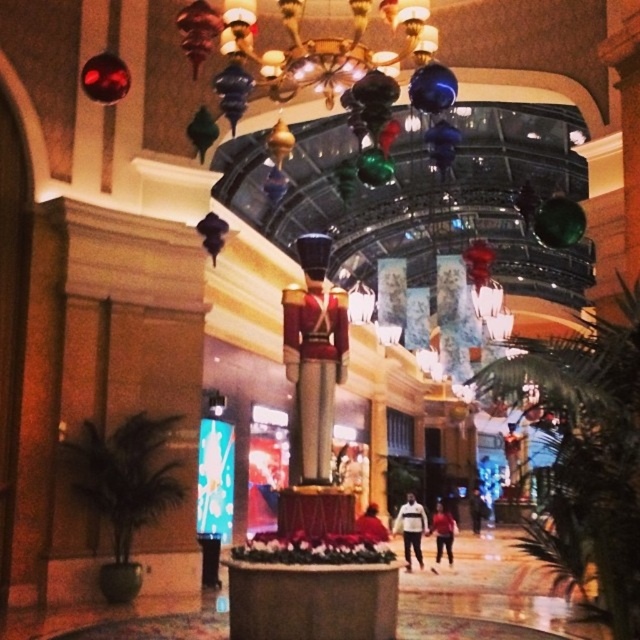
Question: Considering the real-world distances, which object is closest to the dark blue fabric jacket at center?

Choices:
 (A) white matte jacket at center
 (B) red fabric jacket at center
 (C) velvet red coat at center

Answer: (B)

Question: Is white matte jacket at center positioned behind red fabric jacket at center?

Choices:
 (A) yes
 (B) no

Answer: (B)

Question: Which of these objects is positioned farthest from the white matte jacket at center?

Choices:
 (A) red fabric jacket at center
 (B) dark blue fabric jacket at center

Answer: (B)

Question: Where is velvet red coat at center located in relation to dark blue fabric jacket at center in the image?

Choices:
 (A) left
 (B) right

Answer: (A)

Question: Does white matte jacket at center lie behind red fabric jacket at center?

Choices:
 (A) no
 (B) yes

Answer: (A)

Question: Which point is farther from the camera taking this photo?

Choices:
 (A) (408, 541)
 (B) (472, 506)

Answer: (B)